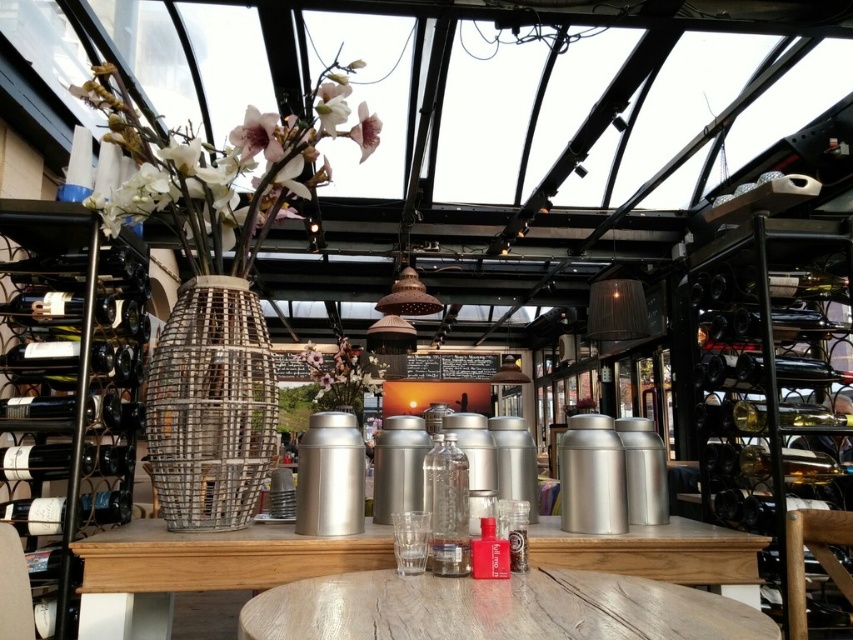
This screenshot has width=853, height=640. I want to click on metallic woven basket at center, so click(210, 404).

Which is more to the right, metallic woven basket at center or matte white flower at upper center?

Positioned to the right is matte white flower at upper center.

I want to click on metallic woven basket at center, so click(x=210, y=404).

Does metallic woven basket at center appear over metallic wire basket at center?

Yes.

Who is shorter, metallic woven basket at center or metallic wire basket at center?

With less height is metallic woven basket at center.

Locate an element on the screen. The image size is (853, 640). metallic woven basket at center is located at coordinates (210, 404).

Can you confirm if clear glass bottle at center is thinner than pink matte flower at upper center?

Correct, clear glass bottle at center's width is less than pink matte flower at upper center's.

Is point (427, 460) positioned after point (352, 132)?

No, (427, 460) is closer to viewer.

Where is `clear glass bottle at center`? This screenshot has width=853, height=640. clear glass bottle at center is located at coordinates (447, 506).